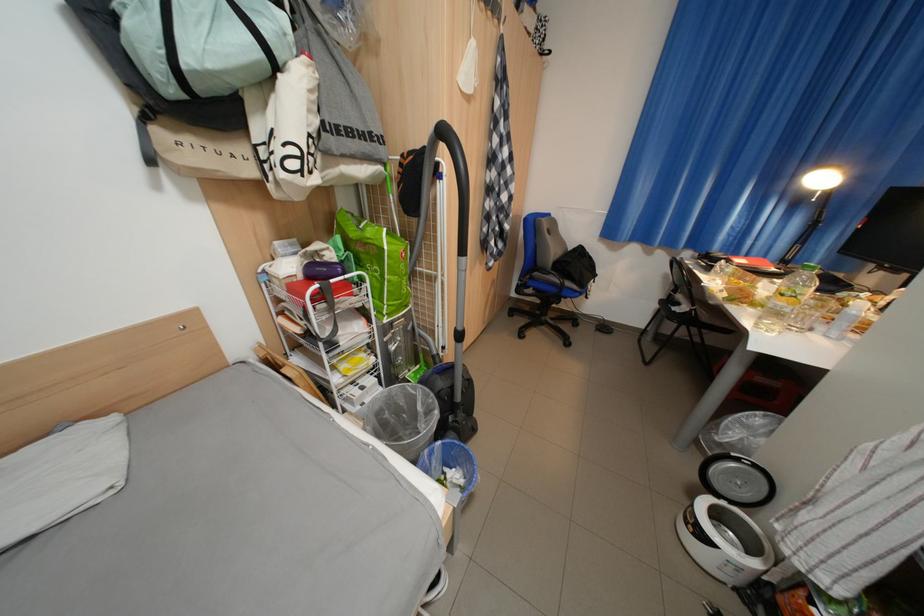
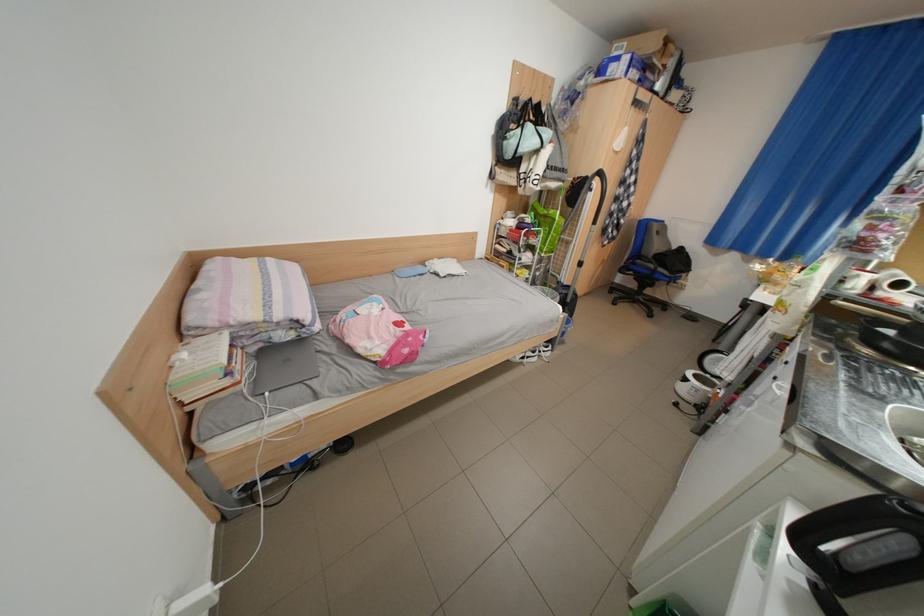
Where in the second image is the point corresponding to [272,55] from the first image?

(552, 147)